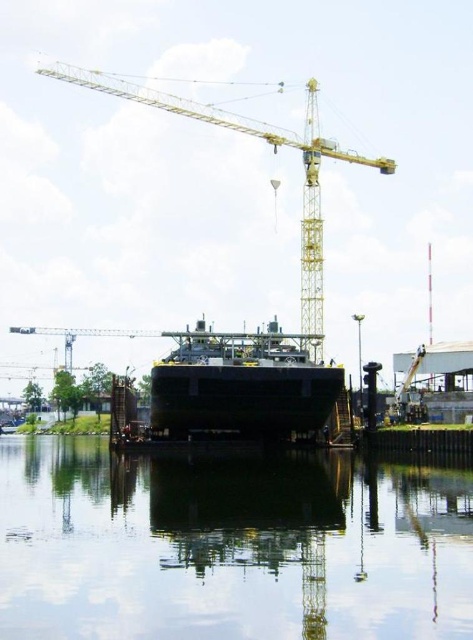
Question: Estimate the real-world distances between objects in this image. Which object is farther from the transparent glass water at center?

Choices:
 (A) black matte ship at center
 (B) yellow metallic crane at upper center

Answer: (B)

Question: Which object is closer to the camera taking this photo?

Choices:
 (A) black matte ship at center
 (B) transparent glass water at center

Answer: (B)

Question: Where is transparent glass water at center located in relation to yellow metallic crane at upper center in the image?

Choices:
 (A) right
 (B) left

Answer: (A)

Question: Can you confirm if transparent glass water at center is positioned above yellow metallic crane at upper center?

Choices:
 (A) no
 (B) yes

Answer: (A)

Question: Which of the following is the closest to the observer?

Choices:
 (A) (201, 518)
 (B) (299, 336)
 (C) (180, 108)

Answer: (A)

Question: Does black matte ship at center have a smaller size compared to yellow metallic crane at upper center?

Choices:
 (A) yes
 (B) no

Answer: (A)